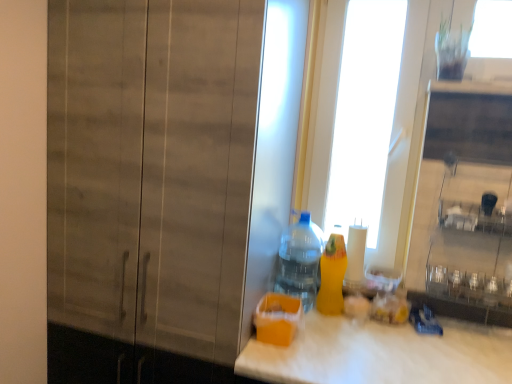
Question: Is point (288, 291) positioned closer to the camera than point (330, 264)?

Choices:
 (A) farther
 (B) closer

Answer: (A)

Question: From the image's perspective, is translucent plastic bottle at center, the 2th bottle from the right, above or below yellow matte bottle at right, the first bottle viewed from the right?

Choices:
 (A) below
 (B) above

Answer: (B)

Question: Which of these objects is positioned closest to the yellow matte bottle at right, marked as the 2th bottle in a left-to-right arrangement?

Choices:
 (A) transparent glass door at upper center
 (B) wooden cabinet at left
 (C) translucent plastic bottle at center, the 2th bottle from the right

Answer: (C)

Question: Which of these objects is positioned closest to the yellow matte bottle at right, marked as the 2th bottle in a left-to-right arrangement?

Choices:
 (A) translucent plastic bottle at center, the 2th bottle from the right
 (B) transparent glass door at upper center
 (C) wooden cabinet at left

Answer: (A)